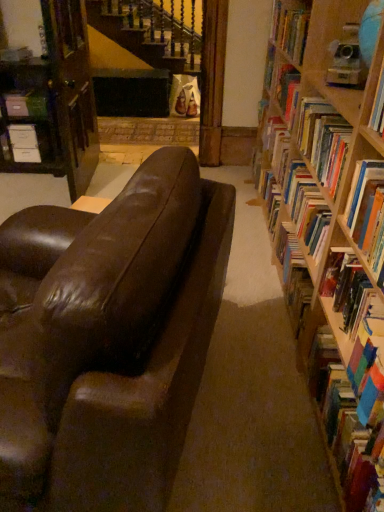
Question: From the image's perspective, is multicolored paperbacks at right, the third book positioned from the back, located above hardcover book at right, acting as the 2th book starting from the back?

Choices:
 (A) yes
 (B) no

Answer: (B)

Question: From the image's perspective, is multicolored paperbacks at right, positioned as the 4th book in top-to-bottom order, below hardcover book at right, marked as the second book in a top-to-bottom arrangement?

Choices:
 (A) yes
 (B) no

Answer: (A)

Question: Is multicolored paperbacks at right, positioned as the 4th book in top-to-bottom order, not close to hardcover book at right, the 3th book positioned from the front?

Choices:
 (A) no
 (B) yes

Answer: (A)

Question: Is multicolored paperbacks at right, the first book positioned from the bottom, at the left side of hardcover book at right, marked as the second book in a top-to-bottom arrangement?

Choices:
 (A) no
 (B) yes

Answer: (B)

Question: Is multicolored paperbacks at right, the third book positioned from the back, positioned with its back to hardcover book at right, the 3th book positioned from the front?

Choices:
 (A) no
 (B) yes

Answer: (A)

Question: Considering the relative positions of multicolored paperbacks at right, positioned as the 4th book in top-to-bottom order, and hardcover book at right, the 3th book positioned from the front, in the image provided, is multicolored paperbacks at right, positioned as the 4th book in top-to-bottom order, behind hardcover book at right, the 3th book positioned from the front,?

Choices:
 (A) yes
 (B) no

Answer: (B)

Question: Could you tell me if shiny brown leather couch at center is turned towards hardcover book at upper right, which is the first book from top to bottom?

Choices:
 (A) no
 (B) yes

Answer: (A)

Question: From a real-world perspective, is shiny brown leather couch at center positioned under hardcover book at upper right, the 4th book in the front-to-back sequence, based on gravity?

Choices:
 (A) yes
 (B) no

Answer: (A)

Question: Considering the relative sizes of shiny brown leather couch at center and hardcover book at upper right, which appears as the 1th book when viewed from the back, in the image provided, is shiny brown leather couch at center shorter than hardcover book at upper right, which appears as the 1th book when viewed from the back,?

Choices:
 (A) yes
 (B) no

Answer: (B)

Question: From a real-world perspective, is shiny brown leather couch at center physically above hardcover book at upper right, positioned as the 4th book in bottom-to-top order?

Choices:
 (A) no
 (B) yes

Answer: (A)

Question: Is shiny brown leather couch at center outside of hardcover book at upper right, positioned as the 4th book in bottom-to-top order?

Choices:
 (A) yes
 (B) no

Answer: (A)

Question: Is shiny brown leather couch at center in contact with hardcover book at upper right, positioned as the 4th book in bottom-to-top order?

Choices:
 (A) yes
 (B) no

Answer: (B)

Question: From a real-world perspective, does wooden bookcase at left stand above shiny brown leather couch at center?

Choices:
 (A) yes
 (B) no

Answer: (A)